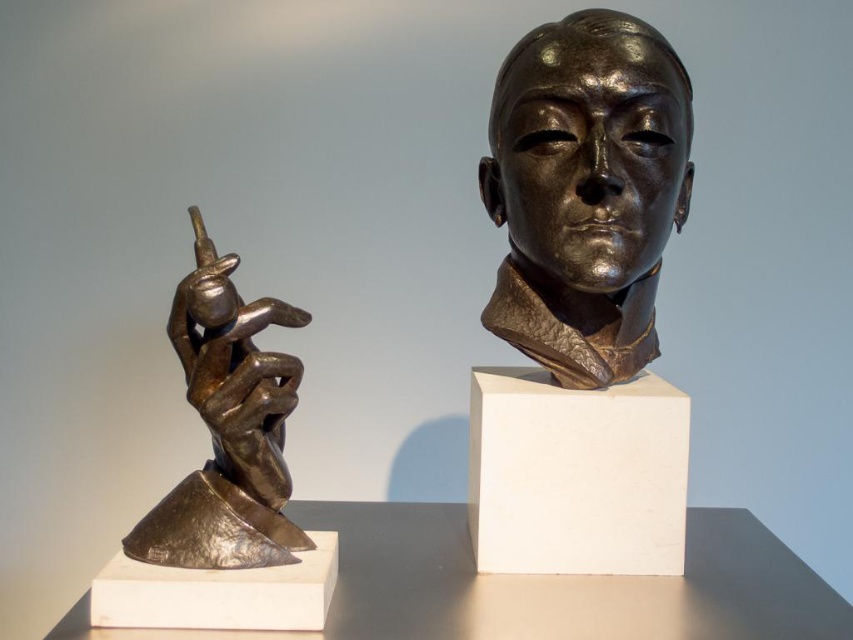
Is point (482, 188) more distant than point (537, 545)?

Yes, it is.

In the scene shown: Can you confirm if bronze head at center is positioned above white matte pedestal at center?

Yes, bronze head at center is above white matte pedestal at center.

The height and width of the screenshot is (640, 853). I want to click on bronze head at center, so click(x=589, y=148).

Identify the location of bronze head at center. The width and height of the screenshot is (853, 640). [x=589, y=148].

Is point (621, 80) positioned behind point (277, 445)?

Yes, it is behind point (277, 445).

Who is more forward, (x=587, y=67) or (x=165, y=506)?

Positioned in front is point (x=165, y=506).

Where is `bronze head at center`? This screenshot has width=853, height=640. bronze head at center is located at coordinates (589, 148).

How far apart are white matte pedestal at center and bronze textured hand at left?

white matte pedestal at center and bronze textured hand at left are 11.18 inches apart.

Who is taller, white matte pedestal at center or bronze textured hand at left?

bronze textured hand at left

Is point (485, 456) behind point (225, 269)?

Yes, point (485, 456) is farther from viewer.

Locate an element on the screen. This screenshot has width=853, height=640. white matte pedestal at center is located at coordinates (x=575, y=474).